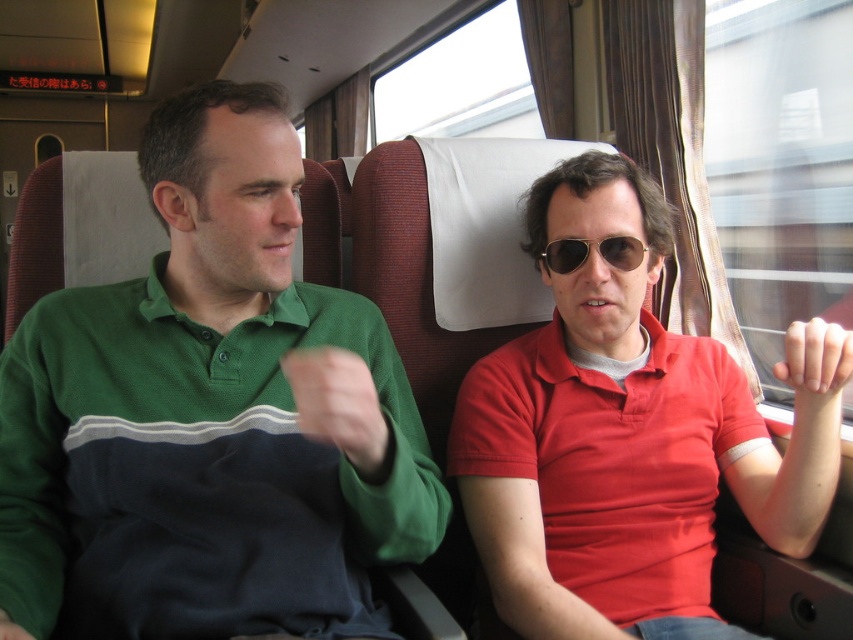
Question: Is green cotton shirt at left smaller than smooth skin hand at center right?

Choices:
 (A) yes
 (B) no

Answer: (B)

Question: Among these objects, which one is farthest from the camera?

Choices:
 (A) smooth skin hand at center right
 (B) metallic aviator sunglasses at center
 (C) green cotton shirt at left

Answer: (B)

Question: Is matte red polo shirt at center closer to camera compared to smooth skin hand at center right?

Choices:
 (A) yes
 (B) no

Answer: (B)

Question: Which object appears farthest from the camera in this image?

Choices:
 (A) smooth skin hand at center right
 (B) metallic aviator sunglasses at center
 (C) green cotton shirt at left
 (D) matte red polo shirt at center

Answer: (B)

Question: Is green cotton shirt at left bigger than matte red polo shirt at center?

Choices:
 (A) no
 (B) yes

Answer: (B)

Question: Which of these objects is positioned closest to the smooth skin hand at center right?

Choices:
 (A) green cotton shirt at left
 (B) metallic aviator sunglasses at center
 (C) matte red polo shirt at center

Answer: (C)